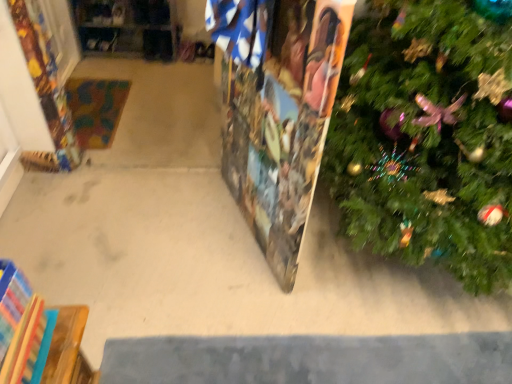
Question: Is wooden puzzle piece at center shorter than wooden at left?

Choices:
 (A) no
 (B) yes

Answer: (A)

Question: Is wooden puzzle piece at center smaller than wooden at left?

Choices:
 (A) yes
 (B) no

Answer: (B)

Question: From a real-world perspective, is wooden puzzle piece at center located higher than wooden at left?

Choices:
 (A) yes
 (B) no

Answer: (A)

Question: Is wooden at left at the back of wooden puzzle piece at center?

Choices:
 (A) yes
 (B) no

Answer: (B)

Question: Is wooden puzzle piece at center to the left of wooden at left from the viewer's perspective?

Choices:
 (A) no
 (B) yes

Answer: (A)

Question: Considering the positions of green textured christmas tree at right and wooden puzzle piece at center in the image, is green textured christmas tree at right taller or shorter than wooden puzzle piece at center?

Choices:
 (A) tall
 (B) short

Answer: (A)

Question: Is green textured christmas tree at right inside or outside of wooden puzzle piece at center?

Choices:
 (A) inside
 (B) outside

Answer: (B)

Question: Based on their sizes in the image, would you say green textured christmas tree at right is bigger or smaller than wooden puzzle piece at center?

Choices:
 (A) small
 (B) big

Answer: (B)

Question: From the image's perspective, relative to wooden puzzle piece at center, is green textured christmas tree at right above or below?

Choices:
 (A) below
 (B) above

Answer: (B)

Question: Looking at the image, does wooden puzzle piece at center seem bigger or smaller compared to wooden at left?

Choices:
 (A) small
 (B) big

Answer: (B)

Question: Looking at their shapes, would you say wooden puzzle piece at center is wider or thinner than wooden at left?

Choices:
 (A) wide
 (B) thin

Answer: (B)

Question: Is point (242, 69) closer or farther from the camera than point (76, 0)?

Choices:
 (A) farther
 (B) closer

Answer: (B)

Question: Is wooden puzzle piece at center to the left or to the right of wooden at left in the image?

Choices:
 (A) left
 (B) right

Answer: (B)

Question: Considering the positions of point (249, 203) and point (376, 246), is point (249, 203) closer or farther from the camera than point (376, 246)?

Choices:
 (A) farther
 (B) closer

Answer: (A)

Question: In terms of size, does wooden puzzle piece at center appear bigger or smaller than green textured christmas tree at right?

Choices:
 (A) small
 (B) big

Answer: (A)